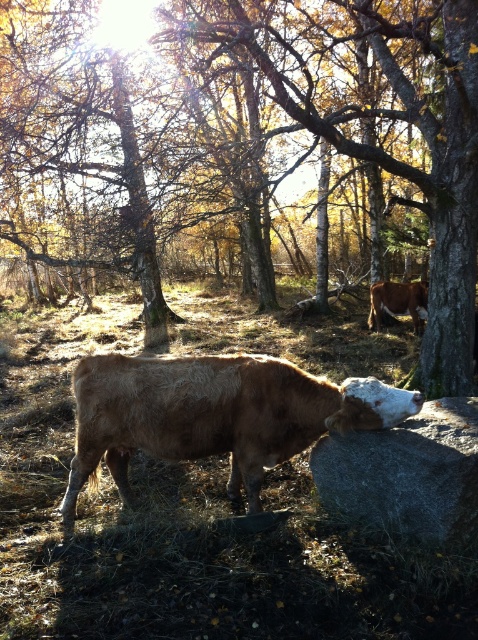
Question: Which point is farther to the camera?

Choices:
 (A) brown fuzzy bull at center
 (B) brown grass at center
 (C) gray granite boulder at lower center

Answer: (A)

Question: Estimate the real-world distances between objects in this image. Which object is closer to the brown fuzzy bull at center?

Choices:
 (A) brown bark tree at center
 (B) brown grass at center

Answer: (B)

Question: Does brown bark tree at center have a greater width compared to brown fuzzy bull at center?

Choices:
 (A) no
 (B) yes

Answer: (B)

Question: Does gray granite boulder at lower center appear on the right side of brown furry bull at center?

Choices:
 (A) no
 (B) yes

Answer: (A)

Question: Among these points, which one is farthest from the camera?

Choices:
 (A) (229, 420)
 (B) (183, 513)
 (C) (288, 120)
 (D) (475, 508)

Answer: (C)

Question: Is brown grass at center wider than brown furry bull at center?

Choices:
 (A) yes
 (B) no

Answer: (A)